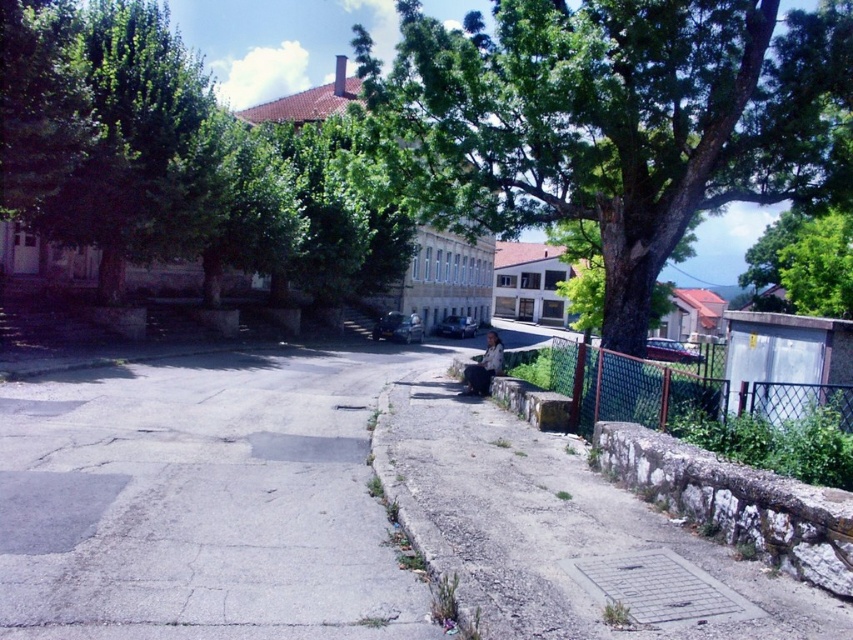
Question: Which of these objects is positioned farthest from the green mesh fence at lower right?

Choices:
 (A) green leafy tree at center
 (B) gray concrete pavement at center

Answer: (A)

Question: From the image, what is the correct spatial relationship of gray concrete pavement at center in relation to green mesh fence at lower right?

Choices:
 (A) above
 (B) below

Answer: (B)

Question: Which object appears closest to the camera in this image?

Choices:
 (A) gray concrete pavement at center
 (B) green mesh fence at lower right

Answer: (A)

Question: Is the position of green leafy tree at center more distant than that of green mesh fence at lower right?

Choices:
 (A) yes
 (B) no

Answer: (A)

Question: Which object is the farthest from the green mesh fence at lower right?

Choices:
 (A) gray concrete pavement at center
 (B) green leafy tree at center

Answer: (B)

Question: Is green leafy tree at center to the right of green mesh fence at lower right from the viewer's perspective?

Choices:
 (A) no
 (B) yes

Answer: (A)